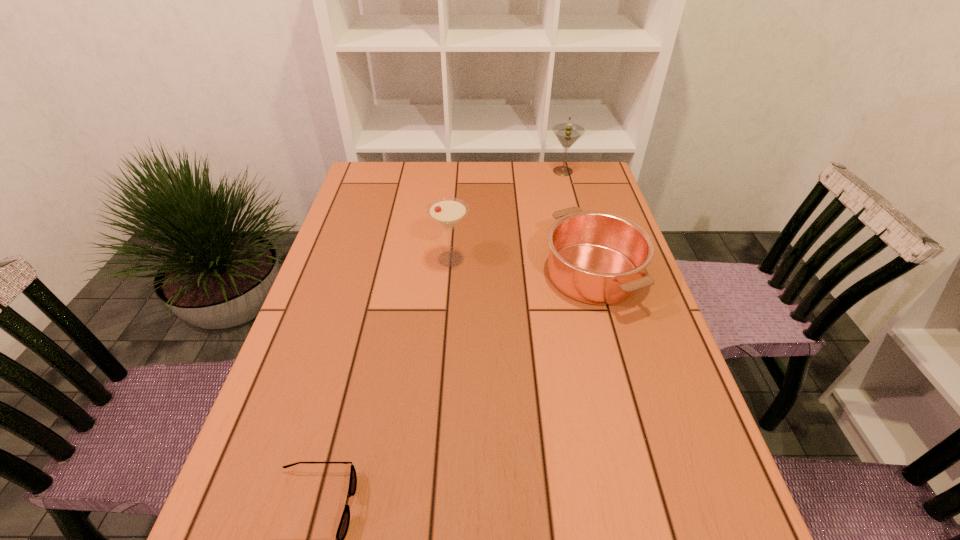
In order to click on the farthest object in this screenshot , I will do `click(567, 133)`.

I want to click on the farther martini, so click(567, 133).

Image resolution: width=960 pixels, height=540 pixels. Identify the location of the nearer martini. (448, 211).

Locate an element on the screen. The width and height of the screenshot is (960, 540). the third object from right to left is located at coordinates (448, 211).

In order to click on the third tallest object in this screenshot , I will do `click(595, 257)`.

Where is `blank space located 0.140m on the left of the farther martini`? This screenshot has height=540, width=960. blank space located 0.140m on the left of the farther martini is located at coordinates [x=508, y=171].

Where is `vacant space situated 0.150m on the right of the second object from left to right`? vacant space situated 0.150m on the right of the second object from left to right is located at coordinates (525, 259).

Identify the location of free space located 0.150m on the front of the second shortest object. The image size is (960, 540). (620, 375).

This screenshot has width=960, height=540. Find the location of `object at the far edge`. object at the far edge is located at coordinates (567, 133).

You are a GUI agent. You are given a task and a screenshot of the screen. Output one action in this format:
    pyautogui.click(x=<x>, y=<y>)
    Task: Click on the martini that is at the right edge
    The height and width of the screenshot is (540, 960).
    Given the screenshot: What is the action you would take?
    pyautogui.click(x=567, y=133)